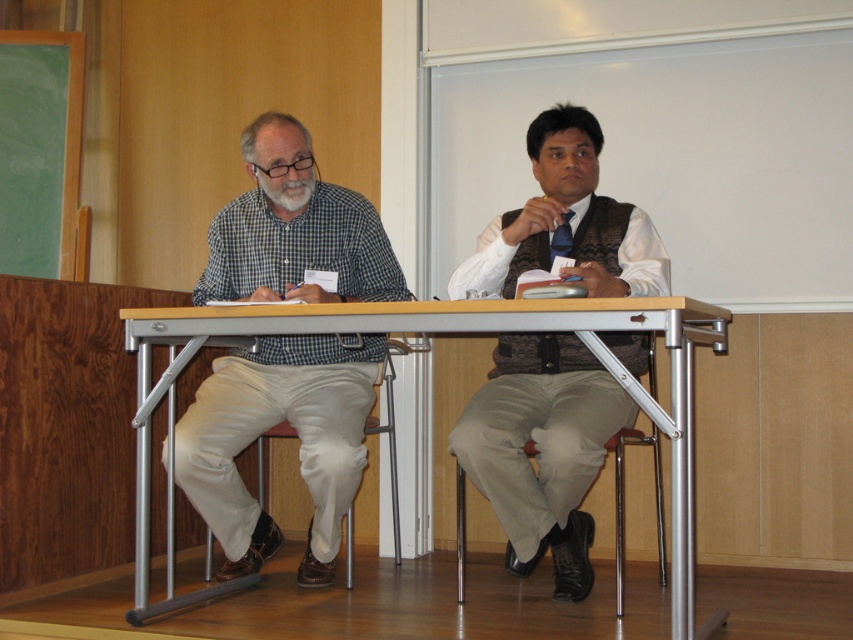
Locate an element on the screen. The image size is (853, 640). matte brown vest at center is located at coordinates (543, 449).

Who is positioned more to the right, matte brown vest at center or metallic silver table at center?

From the viewer's perspective, matte brown vest at center appears more on the right side.

Who is more distant from viewer, (x=560, y=552) or (x=666, y=323)?

The point (x=560, y=552) is more distant.

This screenshot has width=853, height=640. In order to click on matte brown vest at center in this screenshot , I will do `click(543, 449)`.

Is checkered fabric shirt at left in front of matte brown vest at center?

No, it is not.

Who is taller, checkered fabric shirt at left or matte brown vest at center?

Standing taller between the two is matte brown vest at center.

At what (x,y) coordinates should I click in order to perform the action: click on checkered fabric shirt at left. Please return your answer as a coordinate pair (x, y). Looking at the image, I should click on (271, 426).

Locate an element on the screen. The height and width of the screenshot is (640, 853). checkered fabric shirt at left is located at coordinates (271, 426).

Which is in front, point (218, 376) or point (161, 339)?

Point (161, 339) is in front.

Identify the location of checkered fabric shirt at left. (271, 426).

Find the location of a particular element. checkered fabric shirt at left is located at coordinates (271, 426).

Identify the location of checkered fabric shirt at left. This screenshot has height=640, width=853. (271, 426).